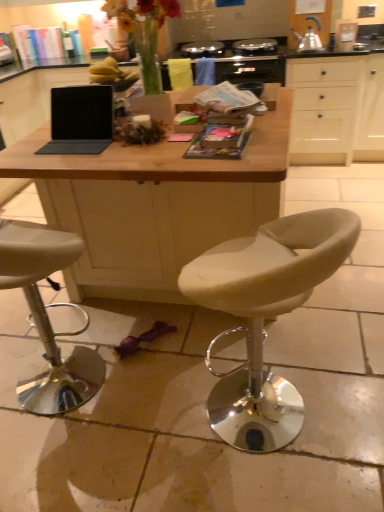
Question: Considering the relative sizes of beige leather stool at lower left, the first chair from the left, and matte black laptop at center in the image provided, is beige leather stool at lower left, the first chair from the left, smaller than matte black laptop at center?

Choices:
 (A) no
 (B) yes

Answer: (A)

Question: Considering the relative positions of beige leather stool at lower left, which ranks as the second chair in right-to-left order, and matte black laptop at center in the image provided, is beige leather stool at lower left, which ranks as the second chair in right-to-left order, to the right of matte black laptop at center from the viewer's perspective?

Choices:
 (A) no
 (B) yes

Answer: (A)

Question: From the image's perspective, is beige leather stool at lower left, which ranks as the second chair in right-to-left order, below matte black laptop at center?

Choices:
 (A) yes
 (B) no

Answer: (A)

Question: Considering the relative sizes of beige leather stool at lower left, which ranks as the second chair in right-to-left order, and matte black laptop at center in the image provided, is beige leather stool at lower left, which ranks as the second chair in right-to-left order, taller than matte black laptop at center?

Choices:
 (A) no
 (B) yes

Answer: (B)

Question: Does beige leather stool at lower left, the first chair from the left, have a lesser height compared to matte black laptop at center?

Choices:
 (A) yes
 (B) no

Answer: (B)

Question: Looking at their shapes, would you say white matte cabinet at upper right is wider or thinner than black glass gas stove at upper center?

Choices:
 (A) thin
 (B) wide

Answer: (A)

Question: Is white matte cabinet at upper right taller or shorter than black glass gas stove at upper center?

Choices:
 (A) tall
 (B) short

Answer: (A)

Question: Does point (309, 82) appear closer or farther from the camera than point (253, 56)?

Choices:
 (A) farther
 (B) closer

Answer: (B)

Question: Which is correct: white matte cabinet at upper right is inside black glass gas stove at upper center, or outside of it?

Choices:
 (A) inside
 (B) outside

Answer: (B)

Question: From the image's perspective, is printed paper magazine at center, the 2th magazine from the front, above or below wooden desk at center?

Choices:
 (A) below
 (B) above

Answer: (B)

Question: In terms of size, does printed paper magazine at center, the second magazine when ordered from bottom to top, appear bigger or smaller than wooden desk at center?

Choices:
 (A) small
 (B) big

Answer: (A)

Question: Considering the positions of printed paper magazine at center, the second magazine when ordered from bottom to top, and wooden desk at center in the image, is printed paper magazine at center, the second magazine when ordered from bottom to top, wider or thinner than wooden desk at center?

Choices:
 (A) thin
 (B) wide

Answer: (A)

Question: Is printed paper magazine at center, the second magazine when ordered from bottom to top, taller or shorter than wooden desk at center?

Choices:
 (A) tall
 (B) short

Answer: (B)

Question: Is beige leather stool at lower left, which ranks as the second chair in right-to-left order, wider or thinner than white matte cabinet at upper right?

Choices:
 (A) thin
 (B) wide

Answer: (A)

Question: Considering the relative positions of beige leather stool at lower left, the first chair from the left, and white matte cabinet at upper right in the image provided, is beige leather stool at lower left, the first chair from the left, to the left or to the right of white matte cabinet at upper right?

Choices:
 (A) right
 (B) left

Answer: (B)